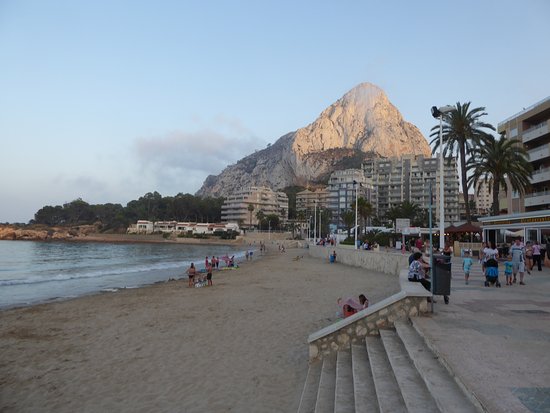
You are a GUI agent. You are given a task and a screenshot of the screen. Output one action in this format:
    pyautogui.click(x=<x>, y=<y>)
    Task: Click on the stairs
    
    Given the screenshot: What is the action you would take?
    pyautogui.click(x=371, y=367)